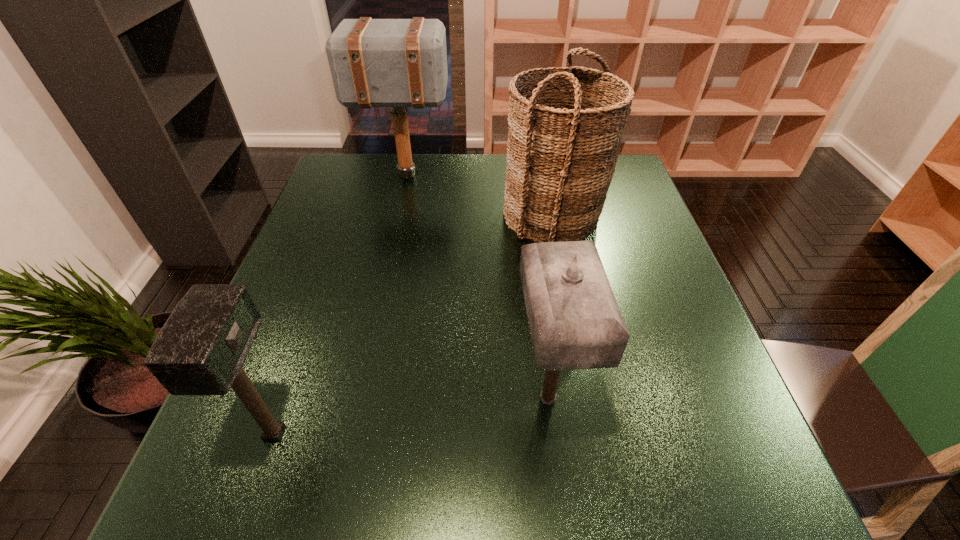
Locate an element on the screen. The image size is (960, 540). vacant space that satisfies the following two spatial constraints: 1. on the striking surface of the farthest mallet; 2. on the left side of the rightmost mallet is located at coordinates (357, 399).

I want to click on vacant area that satisfies the following two spatial constraints: 1. on the striking surface of the basket; 2. on the left side of the farthest mallet, so click(397, 215).

This screenshot has height=540, width=960. In order to click on vacant point that satisfies the following two spatial constraints: 1. on the back side of the basket; 2. on the left side of the shortest mallet in this screenshot , I will do `click(350, 215)`.

Find the location of a particular element. free space that satisfies the following two spatial constraints: 1. on the striking surface of the farthest mallet; 2. on the left side of the rightmost mallet is located at coordinates (357, 399).